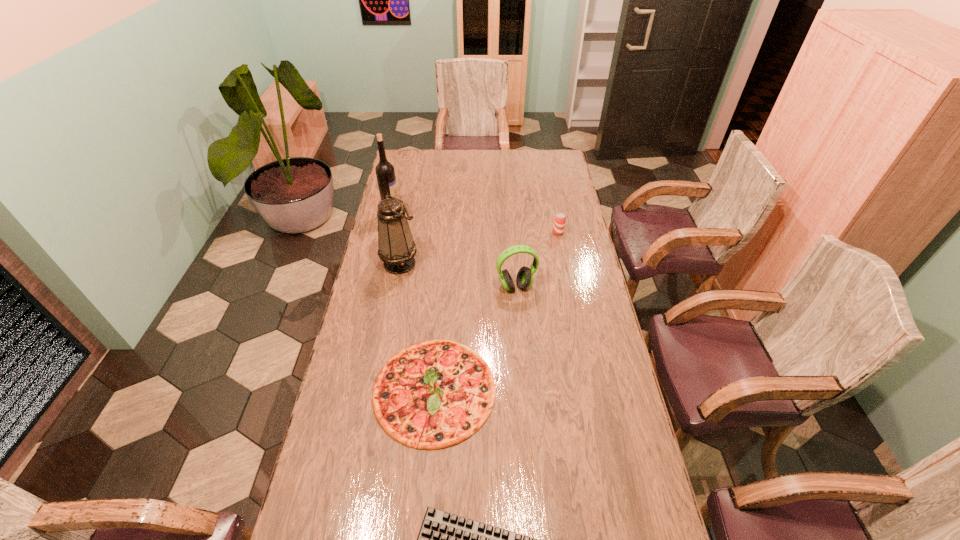
The image size is (960, 540). In order to click on vacant region at the far left corner of the desktop in this screenshot , I will do `click(409, 153)`.

At what (x,y) coordinates should I click in order to perform the action: click on vacant region between the shortest object and the third tallest object. Please return your answer as a coordinate pair (x, y). Looking at the image, I should click on (475, 338).

Locate an element on the screen. Image resolution: width=960 pixels, height=540 pixels. unoccupied area between the second nearest object and the second tallest object is located at coordinates (418, 327).

Locate an element on the screen. free space between the pizza and the beer can is located at coordinates (496, 311).

This screenshot has width=960, height=540. I want to click on free space between the farthest object and the fourth tallest object, so click(475, 224).

Locate which object is the closest to the nearest object. Please provide its 2D coordinates. Your answer should be formatted as a tuple, i.e. [(x, y)], where the tuple contains the x and y coordinates of a point satisfying the conditions above.

[(433, 394)]

You are a GUI agent. You are given a task and a screenshot of the screen. Output one action in this format:
    pyautogui.click(x=<x>, y=<y>)
    Task: Click on the fourth closest object to the third tallest object
    This screenshot has width=960, height=540.
    Given the screenshot: What is the action you would take?
    pyautogui.click(x=385, y=173)

Identify the location of free point that satisfies the following two spatial constraints: 1. on the label of the fourth tallest object; 2. on the right side of the farthest object. The image size is (960, 540). (389, 232).

The width and height of the screenshot is (960, 540). What are the coordinates of `free space that satisfies the following two spatial constraints: 1. on the label of the wine bottle; 2. on the back side of the oil lamp` in the screenshot? It's located at (382, 264).

At what (x,y) coordinates should I click in order to perform the action: click on vacant region that satisfies the following two spatial constraints: 1. on the front side of the pizza; 2. on the right side of the fifth shortest object. Please return your answer as a coordinate pair (x, y). Looking at the image, I should click on (376, 390).